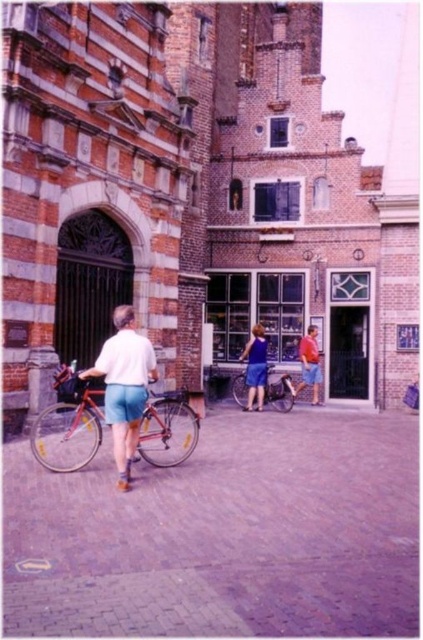
Question: Considering the relative positions of shiny metallic bicycle at center and orange fabric shirt at center in the image provided, where is shiny metallic bicycle at center located with respect to orange fabric shirt at center?

Choices:
 (A) right
 (B) left

Answer: (B)

Question: Which point appears closest to the camera in this image?

Choices:
 (A) (139, 417)
 (B) (263, 374)
 (C) (230, 422)

Answer: (A)

Question: Is shiny metallic bicycle at left thinner than matte blue dress at center?

Choices:
 (A) yes
 (B) no

Answer: (B)

Question: Which of the following is the farthest from the observer?

Choices:
 (A) (308, 330)
 (B) (178, 436)
 (C) (145, 378)

Answer: (A)

Question: Is brick pavement at center bigger than matte blue dress at center?

Choices:
 (A) yes
 (B) no

Answer: (A)

Question: Estimate the real-world distances between objects in this image. Which object is farther from the shiny metallic bicycle at center?

Choices:
 (A) orange fabric shirt at center
 (B) brick pavement at center

Answer: (B)